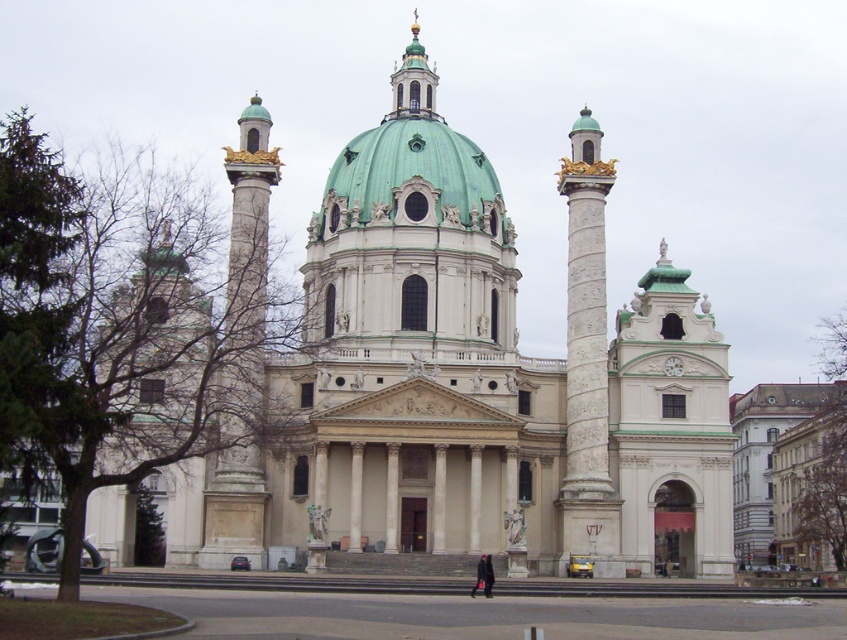
Question: Which of the following is the closest to the observer?

Choices:
 (A) green matte dome at center
 (B) white marble column at right

Answer: (B)

Question: Is white stone church at center thinner than white marble column at right?

Choices:
 (A) yes
 (B) no

Answer: (B)

Question: Does white stone church at center come behind white marble column at right?

Choices:
 (A) no
 (B) yes

Answer: (A)

Question: Is the position of white stone church at center less distant than that of white marble column at right?

Choices:
 (A) no
 (B) yes

Answer: (B)

Question: Which object is positioned closest to the green matte dome at center?

Choices:
 (A) white marble column at right
 (B) white stone church at center

Answer: (B)

Question: Which of the following is the farthest from the observer?

Choices:
 (A) (576, 413)
 (B) (388, 138)
 (C) (346, 500)

Answer: (B)